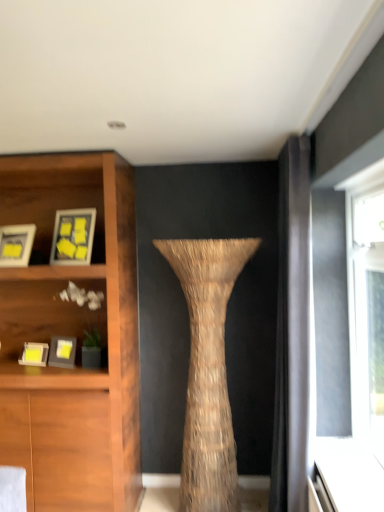
Question: Considering the positions of braided straw vase at center and matte gray picture frame at left, acting as the fourth picture frame starting from the top, in the image, is braided straw vase at center taller or shorter than matte gray picture frame at left, acting as the fourth picture frame starting from the top,?

Choices:
 (A) short
 (B) tall

Answer: (B)

Question: Considering the positions of braided straw vase at center and matte gray picture frame at left, which is the first picture frame from bottom to top, in the image, is braided straw vase at center wider or thinner than matte gray picture frame at left, which is the first picture frame from bottom to top,?

Choices:
 (A) thin
 (B) wide

Answer: (B)

Question: Which is nearer to the matte wooden picture frame at upper left, which is counted as the 1th picture frame, starting from the top?

Choices:
 (A) braided straw vase at center
 (B) matte gray picture frame at left, acting as the fourth picture frame starting from the top
 (C) matte black picture frame at upper left, which is the 3th picture frame from bottom to top
 (D) matte black picture frame at left, the 3th picture frame viewed from the top

Answer: (C)

Question: Based on their relative distances, which object is farther from the matte wooden picture frame at upper left, the fourth picture frame from the bottom?

Choices:
 (A) braided straw vase at center
 (B) matte black picture frame at left, the 3th picture frame viewed from the top
 (C) matte black picture frame at upper left, which ranks as the 2th picture frame in top-to-bottom order
 (D) matte gray picture frame at left, which is the first picture frame from bottom to top

Answer: (A)